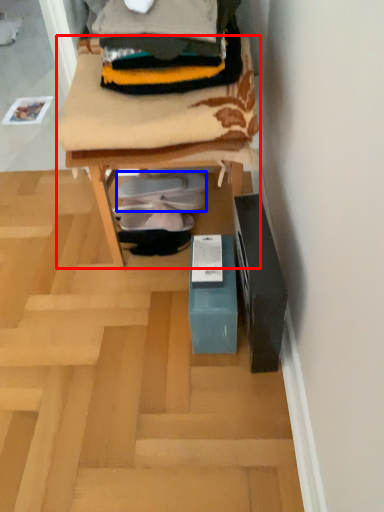
Question: Among these objects, which one is farthest to the camera, furniture (highlighted by a red box) or footwear (highlighted by a blue box)?

Choices:
 (A) furniture
 (B) footwear

Answer: (B)